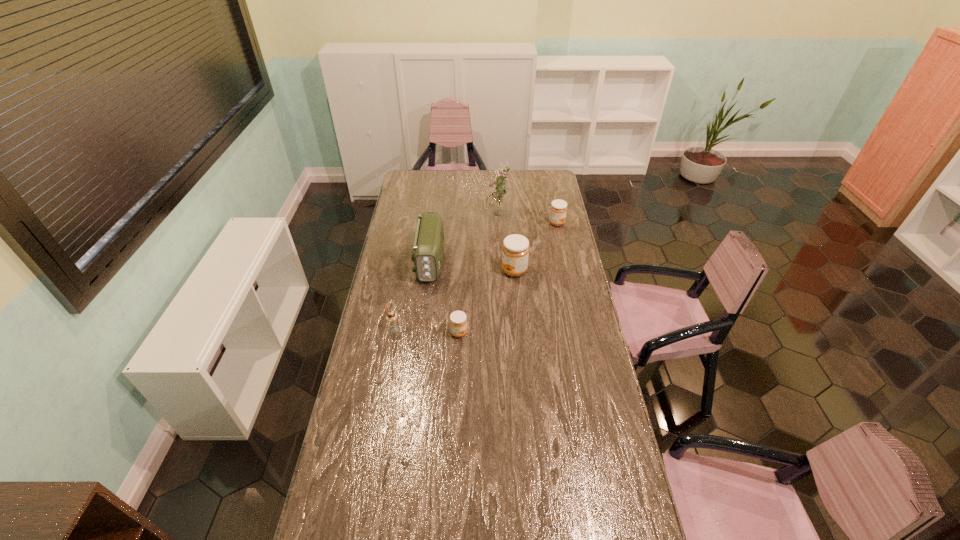
The height and width of the screenshot is (540, 960). I want to click on the third object from left to right, so click(x=458, y=321).

Where is `the shortest jam`? the shortest jam is located at coordinates (458, 321).

Locate an element on the screen. The height and width of the screenshot is (540, 960). the second jam from left to right is located at coordinates (515, 251).

Image resolution: width=960 pixels, height=540 pixels. What are the coordinates of `the tallest jam` in the screenshot? It's located at (515, 251).

Locate an element on the screen. the second tallest jam is located at coordinates (558, 209).

I want to click on the farthest jam, so click(x=558, y=209).

Locate an element on the screen. bouquet is located at coordinates (497, 202).

Where is `the fifth object from right to left`? This screenshot has height=540, width=960. the fifth object from right to left is located at coordinates (428, 246).

The image size is (960, 540). I want to click on icecream, so click(391, 317).

What are the coordinates of `free space located 0.060m on the front label of the nearest jam` in the screenshot? It's located at (482, 333).